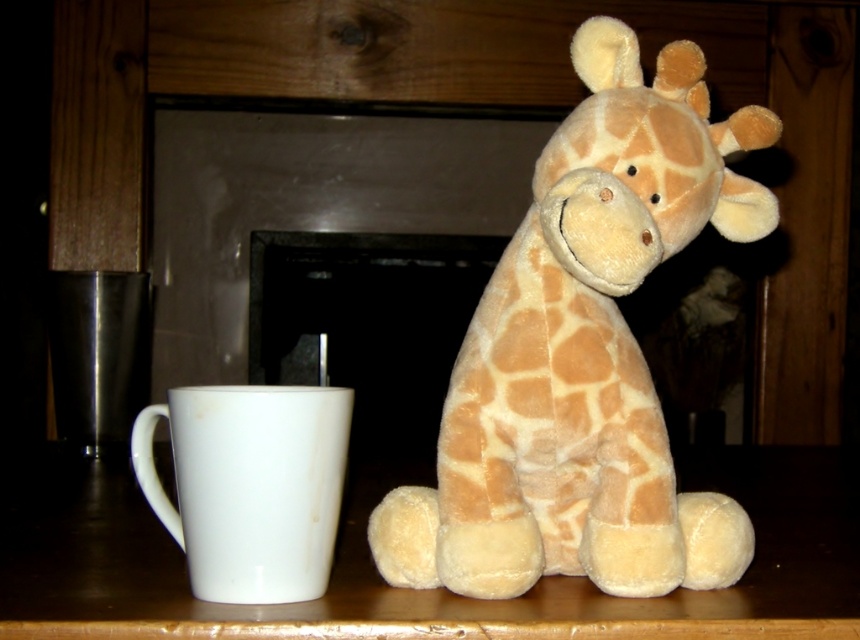
Based on the photo, does soft plush giraffe at center have a greater width compared to smooth wooden table at center?

No.

Is soft plush giraffe at center positioned at the back of smooth wooden table at center?

Yes, soft plush giraffe at center is further from the viewer.

Between point (631, 536) and point (9, 580), which one is positioned behind?

The point (9, 580) is behind.

Identify the location of soft plush giraffe at center. (584, 355).

Is soft plush giraffe at center thinner than white glossy mug at left?

No.

Which of these two, soft plush giraffe at center or white glossy mug at left, stands shorter?

white glossy mug at left is shorter.

Is point (650, 502) positioned before point (189, 579)?

That is False.

What are the coordinates of `soft plush giraffe at center` in the screenshot? It's located at (584, 355).

Does smooth wooden table at center appear on the right side of white glossy mug at left?

Correct, you'll find smooth wooden table at center to the right of white glossy mug at left.

Is point (109, 547) positioned behind point (263, 472)?

Yes, point (109, 547) is behind point (263, 472).

Between point (788, 602) and point (286, 524), which one is positioned behind?

Positioned behind is point (788, 602).

Image resolution: width=860 pixels, height=640 pixels. I want to click on smooth wooden table at center, so click(x=413, y=589).